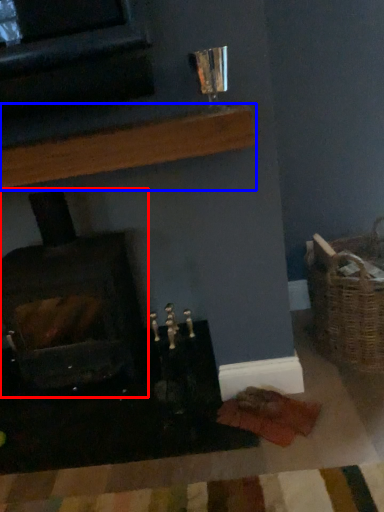
Question: Which point is further to the camera, wood burning stove (highlighted by a red box) or shelf (highlighted by a blue box)?

Choices:
 (A) wood burning stove
 (B) shelf

Answer: (A)